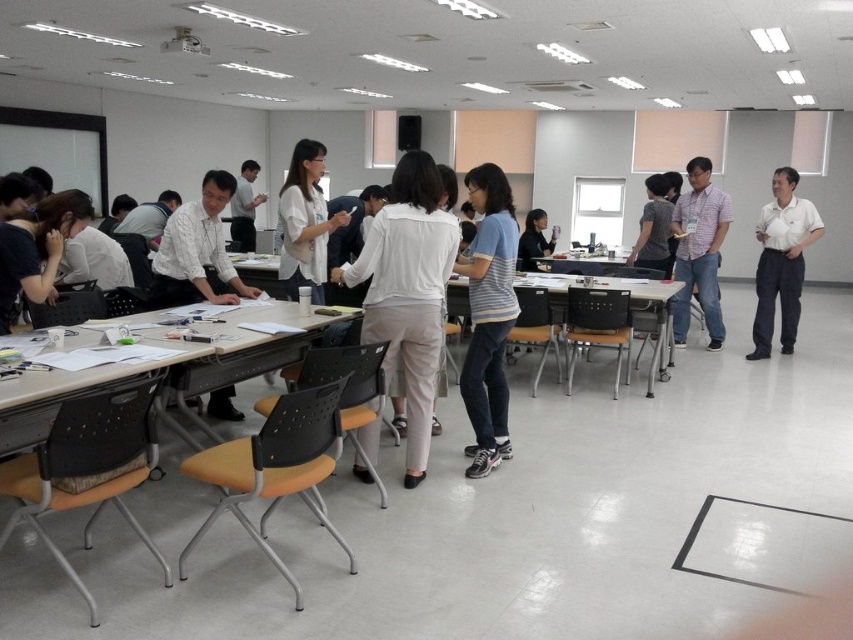
Question: Which point is farther from the camera taking this photo?

Choices:
 (A) (767, 324)
 (B) (13, 404)
 (C) (543, 257)

Answer: (C)

Question: Does wooden table at center come behind white plastic table at center?

Choices:
 (A) no
 (B) yes

Answer: (A)

Question: Which point is farther to the camera?

Choices:
 (A) wooden table at center
 (B) white shirt at center
 (C) white smooth shirt at right
 (D) white plastic table at center

Answer: (D)

Question: Considering the relative positions of wooden table at center and white shirt at center in the image provided, where is wooden table at center located with respect to white shirt at center?

Choices:
 (A) below
 (B) above

Answer: (A)

Question: Does white plastic table at lower left appear over white plastic table at center?

Choices:
 (A) yes
 (B) no

Answer: (B)

Question: Estimate the real-world distances between objects in this image. Which object is farther from the white plastic table at lower left?

Choices:
 (A) white plastic table at center
 (B) wooden table at center
 (C) white smooth shirt at right
 (D) white shirt at center

Answer: (A)